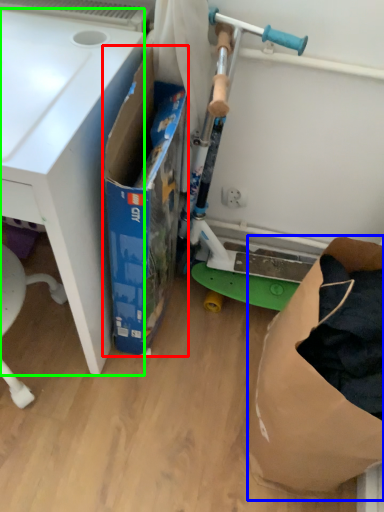
Question: Based on their relative distances, which object is nearer to box (highlighted by a red box)? Choose from paper bag (highlighted by a blue box) and desk (highlighted by a green box).

Choices:
 (A) paper bag
 (B) desk

Answer: (B)